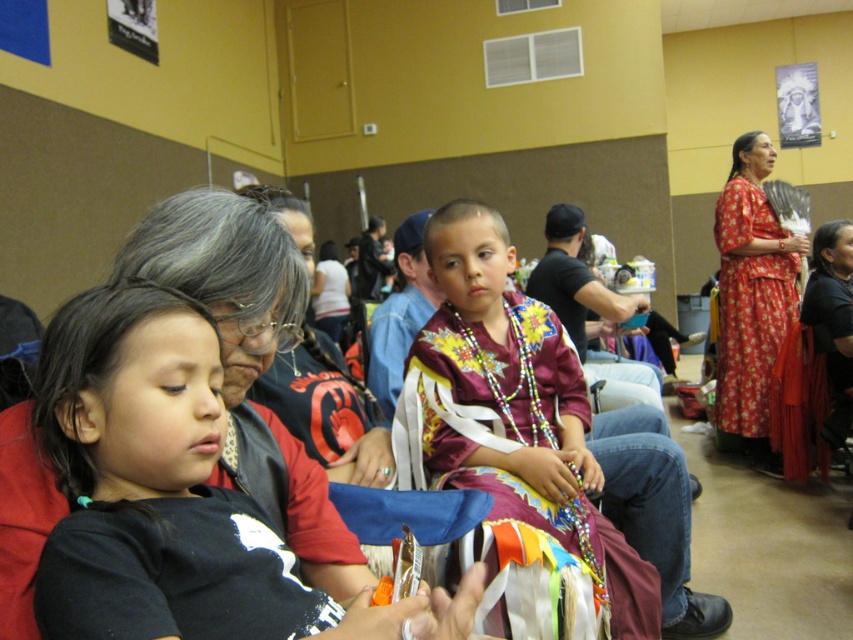
Question: Estimate the real-world distances between objects in this image. Which object is closer to the floral-patterned fabric dress at upper right?

Choices:
 (A) beaded fabric dress at center
 (B) black fabric shirt at left

Answer: (A)

Question: Is black fabric shirt at left thinner than beaded fabric dress at center?

Choices:
 (A) yes
 (B) no

Answer: (A)

Question: Estimate the real-world distances between objects in this image. Which object is farther from the floral-patterned fabric dress at upper right?

Choices:
 (A) black fabric shirt at left
 (B) beaded fabric dress at center

Answer: (A)

Question: Does beaded fabric dress at center appear on the left side of floral-patterned fabric dress at upper right?

Choices:
 (A) yes
 (B) no

Answer: (A)

Question: Which point appears farthest from the camera in this image?

Choices:
 (A) (109, 586)
 (B) (747, 232)
 (C) (514, 445)

Answer: (B)

Question: Can you confirm if black fabric shirt at left is positioned to the right of beaded fabric dress at center?

Choices:
 (A) no
 (B) yes

Answer: (A)